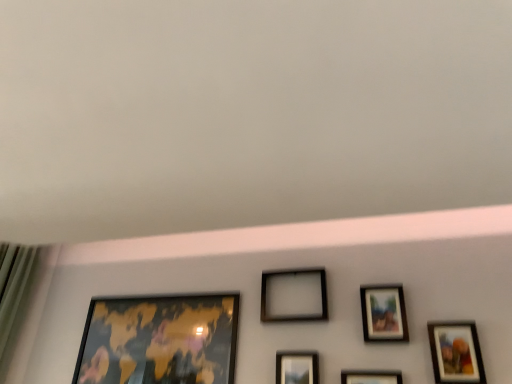
Question: Based on their sizes in the image, would you say matte black picture frame at center, which ranks as the 3th picture frame in right-to-left order, is bigger or smaller than black matte picture frame at center, acting as the fourth picture frame starting from the right?

Choices:
 (A) small
 (B) big

Answer: (A)

Question: From a real-world perspective, relative to black matte picture frame at center, acting as the fourth picture frame starting from the right, is matte black picture frame at center, the fourth picture frame viewed from the left, vertically above or below?

Choices:
 (A) below
 (B) above

Answer: (A)

Question: Estimate the real-world distances between objects in this image. Which object is closer to the gold metallic map at lower left, the 6th picture frame viewed from the right?

Choices:
 (A) matte black picture frame at center, the fifth picture frame positioned from the right
 (B) matte black picture frame at center, which ranks as the 3th picture frame in right-to-left order
 (C) matte wooden picture frame at lower right, positioned as the 1th picture frame in right-to-left order
 (D) matte wooden picture frame at upper right, positioned as the fifth picture frame in left-to-right order
 (E) black matte picture frame at center, acting as the fourth picture frame starting from the right

Answer: (E)

Question: Which of these objects is positioned closest to the matte wooden picture frame at lower right, which appears as the sixth picture frame when viewed from the left?

Choices:
 (A) black matte picture frame at center, acting as the fourth picture frame starting from the right
 (B) matte black picture frame at center, which ranks as the 3th picture frame in right-to-left order
 (C) matte black picture frame at center, the 2th picture frame positioned from the left
 (D) gold metallic map at lower left, the 6th picture frame viewed from the right
 (E) matte wooden picture frame at upper right, the 2th picture frame viewed from the right

Answer: (E)